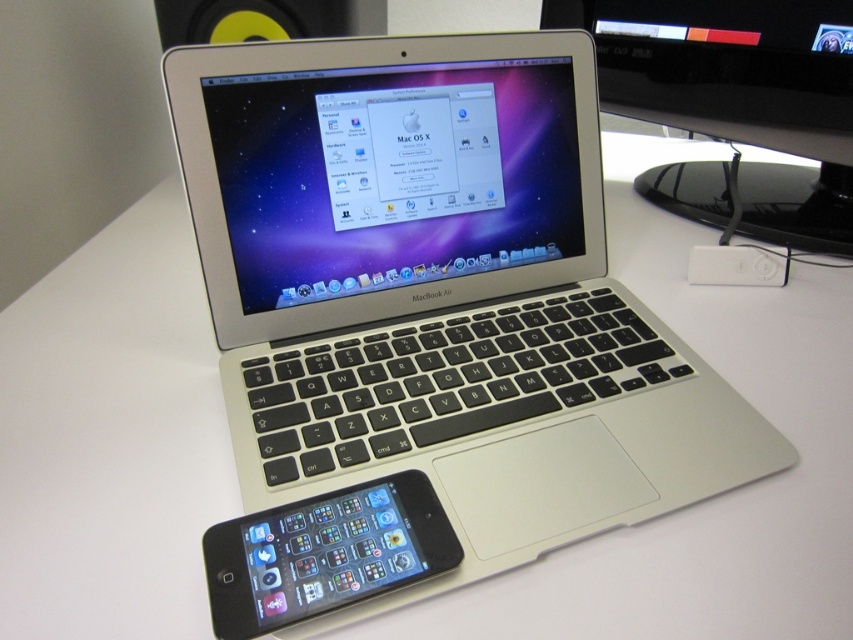
You are setting up a desk and need to place the yellow plastic speaker at upper left and the white plastic ipod at center. Considering their heights, which one should you place on a higher shelf to avoid blocking the other?

The yellow plastic speaker at upper left has a greater height compared to the white plastic ipod at center, so you should place the yellow plastic speaker at upper left on a higher shelf to avoid blocking the white plastic ipod at center.